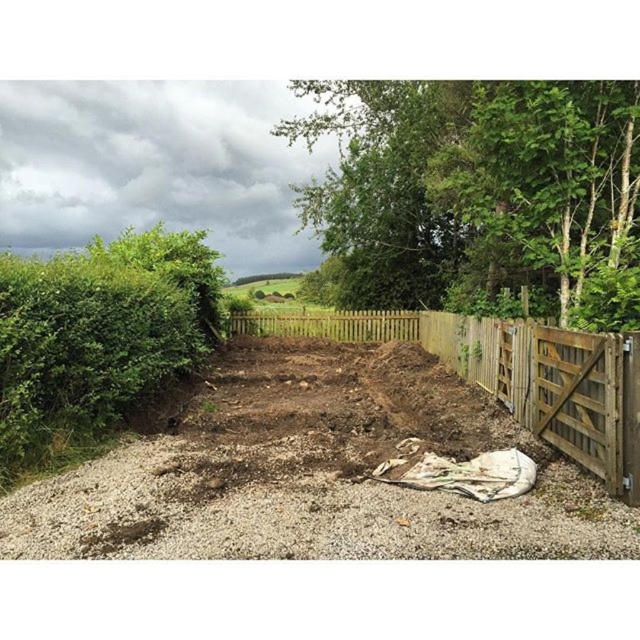
Question: Is brown soil at center further to the viewer compared to green leafy hedge at left?

Choices:
 (A) no
 (B) yes

Answer: (A)

Question: Does green leafy tree at upper right have a smaller size compared to wooden gate at center?

Choices:
 (A) yes
 (B) no

Answer: (B)

Question: Which of the following is the farthest from the observer?

Choices:
 (A) [109, 276]
 (B) [374, 467]
 (C) [472, 369]
 (D) [624, 204]

Answer: (C)

Question: Where is brown soil at center located in relation to green leafy tree at upper right in the image?

Choices:
 (A) left
 (B) right

Answer: (A)

Question: Which object appears closest to the camera in this image?

Choices:
 (A) brown soil at center
 (B) green leafy hedge at left
 (C) wooden gate at center
 (D) green leafy tree at upper right

Answer: (A)

Question: Which is nearer to the brown soil at center?

Choices:
 (A) green leafy hedge at left
 (B) green leafy tree at upper right

Answer: (A)